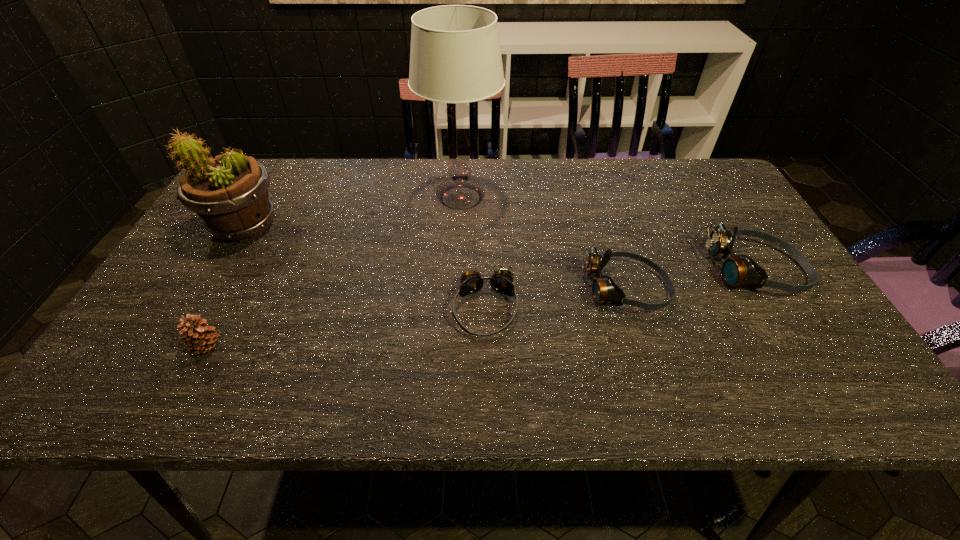
In the current image, all goggless are evenly spaced. To maintain this equal spacing, where should an additional goggles be placed on the left? Please point out a free spot. Please provide its 2D coordinates. Your answer should be formatted as a tuple, i.e. [(x, y)], where the tuple contains the x and y coordinates of a point satisfying the conditions above.

[(331, 330)]